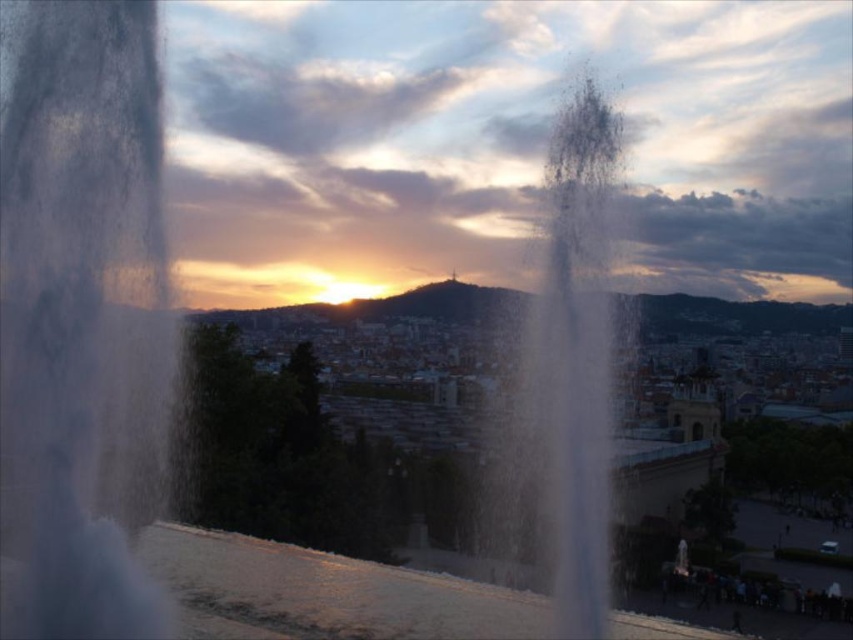
Can you confirm if transparent water at center is shorter than transparent mist at center?

Correct, transparent water at center is not as tall as transparent mist at center.

Can you confirm if transparent water at center is positioned to the right of transparent mist at center?

In fact, transparent water at center is to the left of transparent mist at center.

Does point (62, 621) come closer to viewer compared to point (511, 516)?

Yes, point (62, 621) is in front of point (511, 516).

At what (x,y) coordinates should I click in order to perform the action: click on transparent water at center. Please return your answer as a coordinate pair (x, y). Looking at the image, I should click on (82, 317).